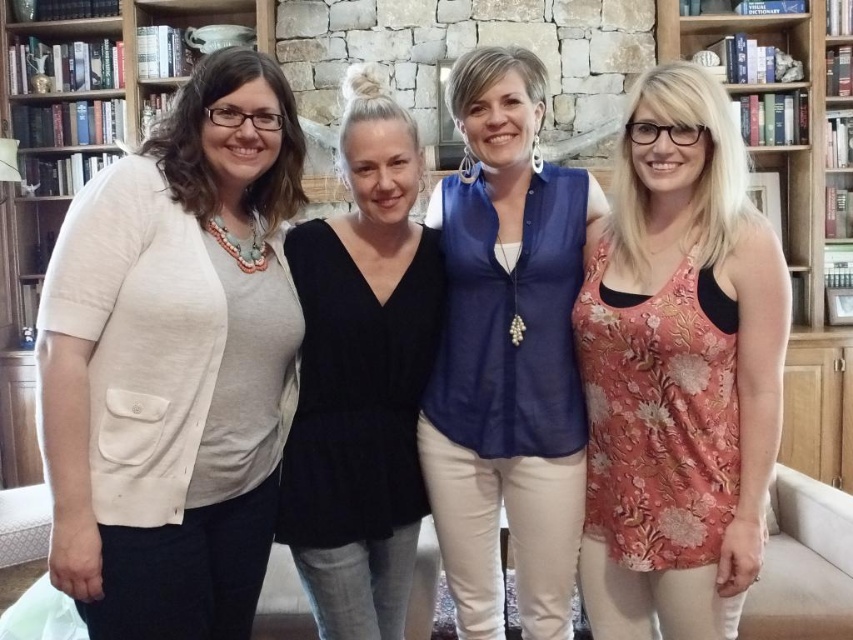
You are standing in the room and want to take a photo of the group. The camera you are using has a zoom lens that can focus on objects within a 0.6 to 0.8 coordinate range on the horizontal axis. Is the floral fabric tank top at right within this focus range?

The floral fabric tank top at right is positioned at point 0.580 on the horizontal axis, which is below the minimum 0.6 required for the camera to focus. Therefore, it will not be within the focus range.

From the picture: You are a fashion designer observing the group of women in the image. You need to determine which clothing item is shorter in height between the matte beige cardigan at left and the black jersey top at center. Which one is it?

The matte beige cardigan at left has a lesser height compared to the black jersey top at center, so the matte beige cardigan at left is shorter in height.

Based on the scene description, can you determine if the floral fabric tank top at right is located below the matte white bookcase at left?

Yes, the floral fabric tank top at right is positioned under the matte white bookcase at left, so it is located below it.